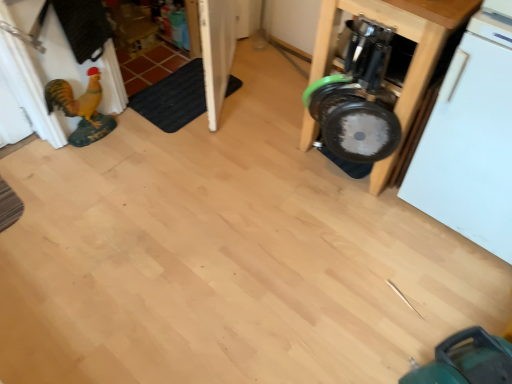
Where is `free spot in front of metallic silver dumbbell at right`? free spot in front of metallic silver dumbbell at right is located at coordinates (356, 239).